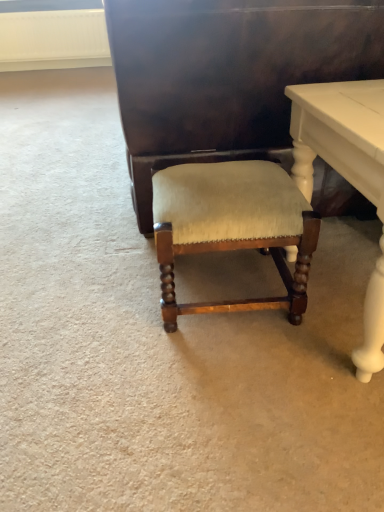
Find the location of a particular element. The image size is (384, 512). vacant space in suede-like beige cushion at center (from a real-world perspective) is located at coordinates (219, 282).